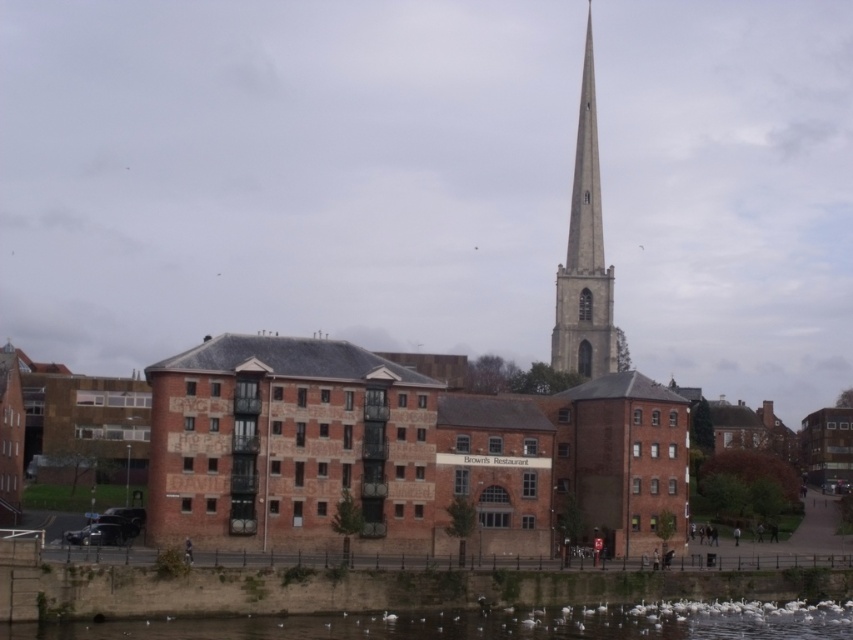
You are a photographer standing on the riverside and want to capture both the brick building at center and the smooth stone spire at center in a single shot. Based on their positions, which one will appear closer to the camera in the photo?

The brick building at center is in front of the smooth stone spire at center, so it will appear closer to the camera in the photo.

You are a photographer trying to capture the smooth stone spire at center and the white fluffy birds at lower center in the same frame. Based on their positions, which object should you adjust your camera to focus on first if you want to include both in your shot?

The white fluffy birds at lower center is positioned on the left side of smooth stone spire at center, so you should focus on the white fluffy birds at lower center first to ensure both are in the frame.